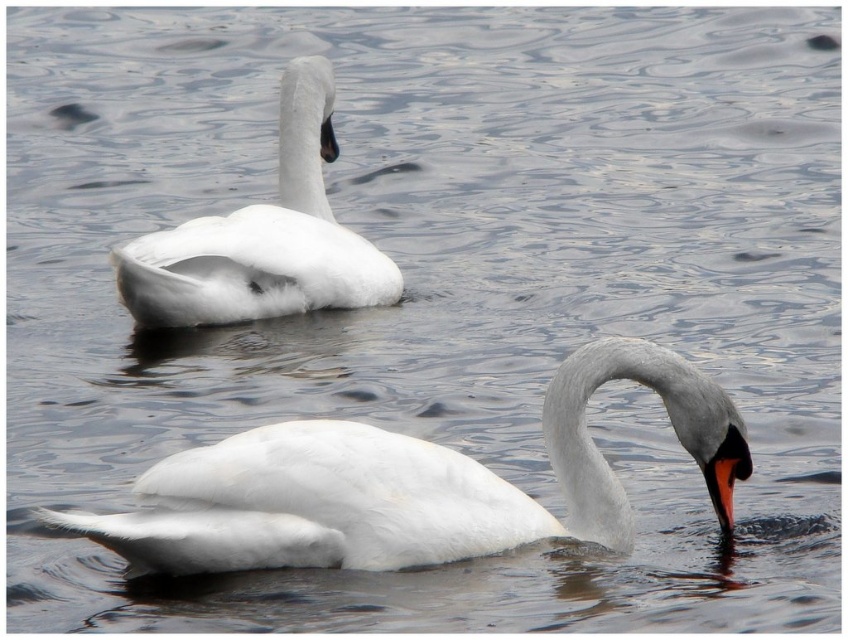
Who is higher up, white glossy swan at lower center or white matte swan at upper left?

white matte swan at upper left is above.

Between point (525, 499) and point (296, 282), which one is positioned in front?

Positioned in front is point (525, 499).

Identify the location of white glossy swan at lower center. (409, 483).